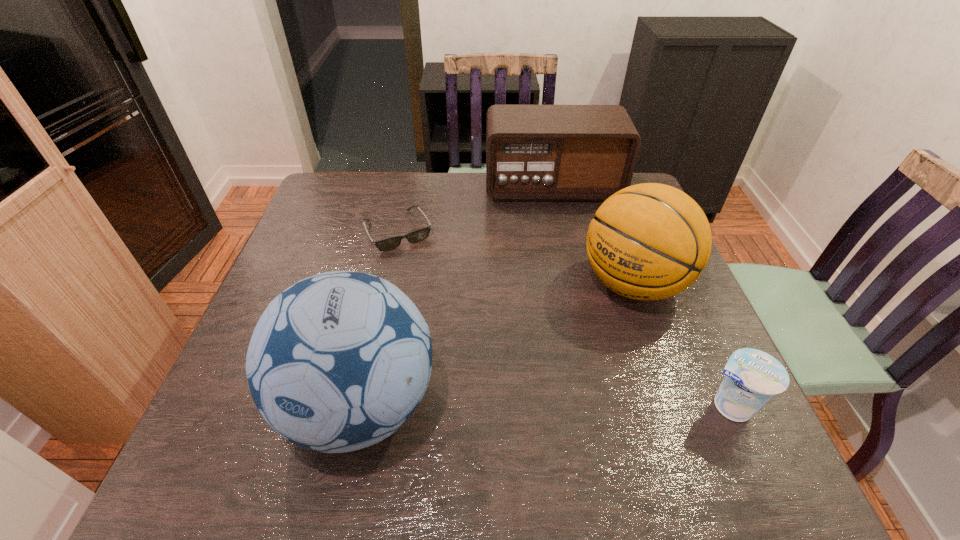
The image size is (960, 540). I want to click on vacant space at the right edge of the desktop, so 638,305.

In the image, there is a desktop. Identify the location of free space at the near right corner. (709, 410).

At what (x,y) coordinates should I click in order to perform the action: click on empty space between the shortest object and the yogurt. Please return your answer as a coordinate pair (x, y). This screenshot has width=960, height=540. Looking at the image, I should click on (564, 319).

You are a GUI agent. You are given a task and a screenshot of the screen. Output one action in this format:
    pyautogui.click(x=<x>, y=<y>)
    Task: Click on the vacant point located between the fourth tallest object and the sunglasses
    The image size is (960, 540).
    Given the screenshot: What is the action you would take?
    pyautogui.click(x=564, y=319)

Where is `free space between the basketball and the sunglasses`? The image size is (960, 540). free space between the basketball and the sunglasses is located at coordinates pyautogui.click(x=516, y=258).

Find the location of a particular element. free space between the basketball and the shortest object is located at coordinates click(516, 258).

Locate an element on the screen. empty location between the basketball and the second shortest object is located at coordinates (681, 345).

The height and width of the screenshot is (540, 960). I want to click on free space between the sunglasses and the yogurt, so click(564, 319).

Find the location of a particular element. The image size is (960, 540). free space between the yogurt and the shortest object is located at coordinates (564, 319).

Locate an element on the screen. The image size is (960, 540). vacant area between the sunglasses and the yogurt is located at coordinates (564, 319).